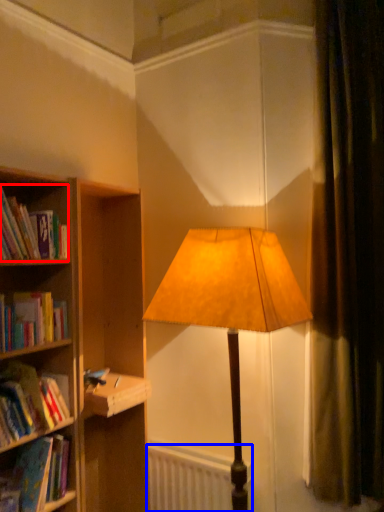
Question: Which object is closer to the camera taking this photo, book (highlighted by a red box) or radiator (highlighted by a blue box)?

Choices:
 (A) book
 (B) radiator

Answer: (A)